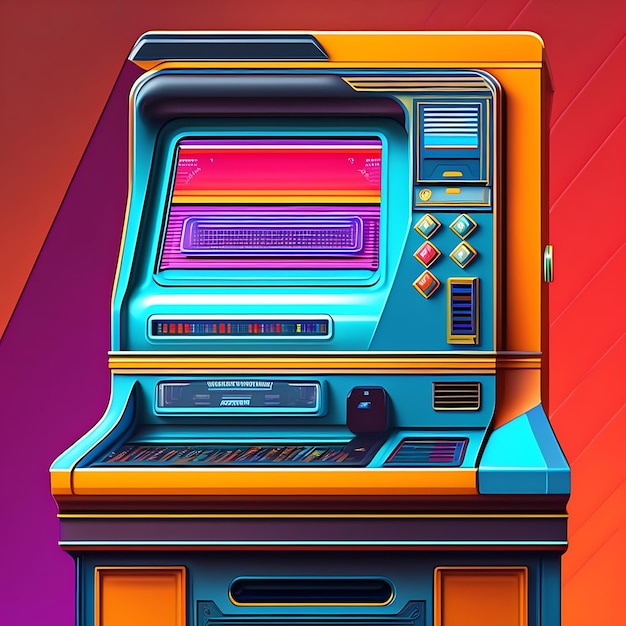
Where is `screen`? The width and height of the screenshot is (626, 626). screen is located at coordinates (283, 187).